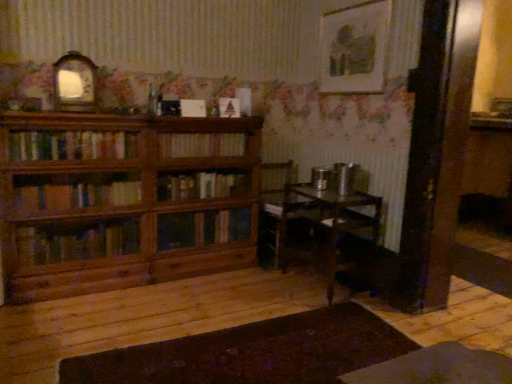
Where is `free area in between wooden table at center and wooden bookcase at left`? This screenshot has height=384, width=512. free area in between wooden table at center and wooden bookcase at left is located at coordinates (206, 292).